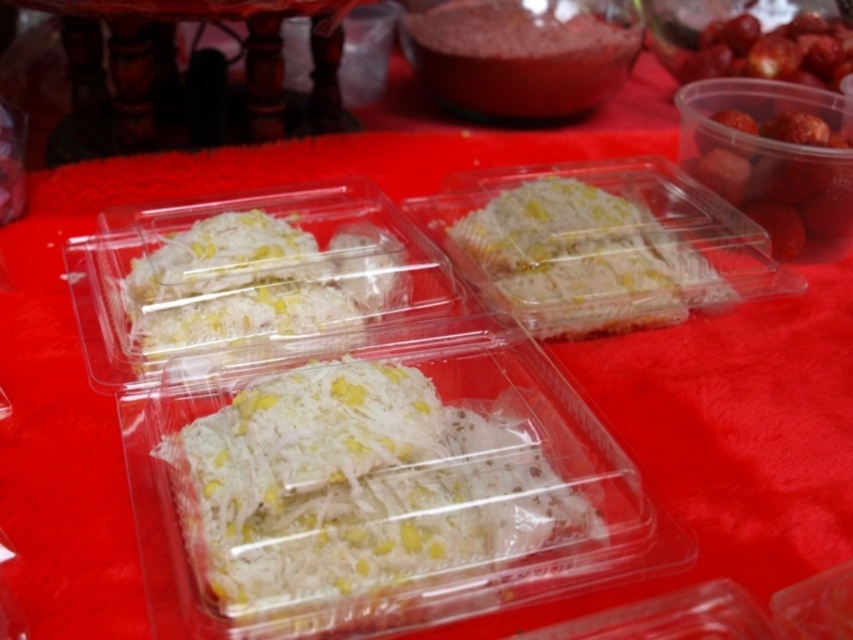
Question: Estimate the real-world distances between objects in this image. Which object is closer to the shiny red strawberries at upper right?

Choices:
 (A) smooth pink powder at center
 (B) white shredded food at center
 (C) white translucent rice at center

Answer: (A)

Question: From the image, what is the correct spatial relationship of white translucent cake at center in relation to smooth pink powder at center?

Choices:
 (A) left
 (B) right

Answer: (B)

Question: Is the position of white translucent cake at center less distant than that of smooth pink powder at center?

Choices:
 (A) no
 (B) yes

Answer: (B)

Question: Where is white translucent cake at center located in relation to white translucent rice at center in the image?

Choices:
 (A) right
 (B) left

Answer: (A)

Question: Which point is farther to the camera?

Choices:
 (A) (666, 244)
 (B) (219, 486)
 (C) (289, 330)

Answer: (A)

Question: Which point is closer to the camera?

Choices:
 (A) shiny red strawberries at upper right
 (B) white translucent rice at center

Answer: (B)